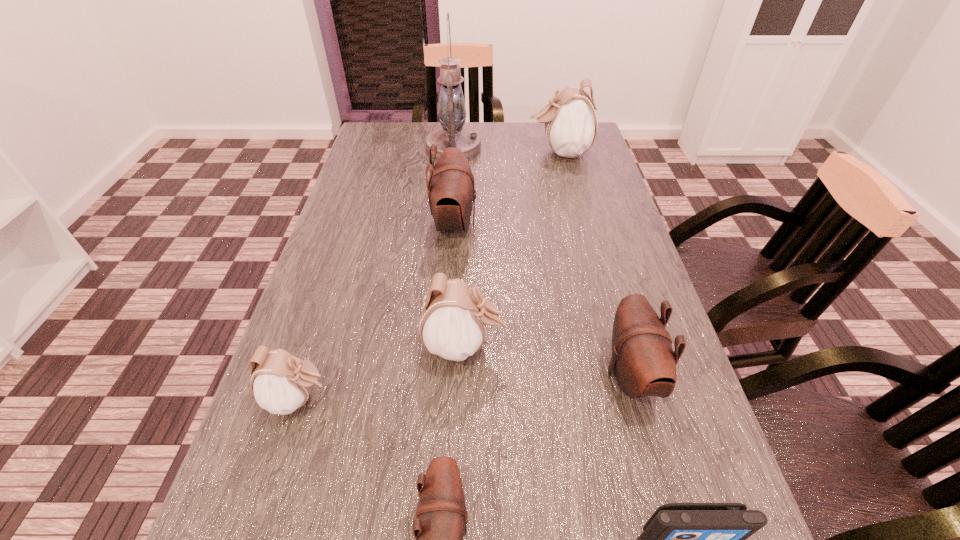
In order to click on empty space between the second smallest white pouch and the tallest object in this screenshot , I will do `click(459, 247)`.

Locate an element on the screen. The width and height of the screenshot is (960, 540). free space between the second nearest brown pouch and the second white pouch from right to left is located at coordinates (547, 360).

Where is `vacant region between the smallest white pouch and the oil lamp`? vacant region between the smallest white pouch and the oil lamp is located at coordinates (376, 273).

Find the location of a particular element. This screenshot has height=540, width=960. free space between the leftmost pouch and the rightmost white pouch is located at coordinates (429, 275).

Where is `object that is the fourth closest to the smallest white pouch`? object that is the fourth closest to the smallest white pouch is located at coordinates (643, 361).

Identify which object is the nearest to the oil lamp. Please provide its 2D coordinates. Your answer should be formatted as a tuple, i.e. [(x, y)], where the tuple contains the x and y coordinates of a point satisfying the conditions above.

[(570, 122)]

Select which pouch is the second closest to the leftmost pouch. Please provide its 2D coordinates. Your answer should be formatted as a tuple, i.e. [(x, y)], where the tuple contains the x and y coordinates of a point satisfying the conditions above.

[(441, 516)]

Where is `pouch that stands as the fourth closest to the leftmost white pouch`? The width and height of the screenshot is (960, 540). pouch that stands as the fourth closest to the leftmost white pouch is located at coordinates (643, 361).

Locate an element on the screen. This screenshot has width=960, height=540. white pouch that stands as the closest to the iPod is located at coordinates (453, 322).

This screenshot has width=960, height=540. Identify the location of white pouch that is the third closest to the iPod. (570, 122).